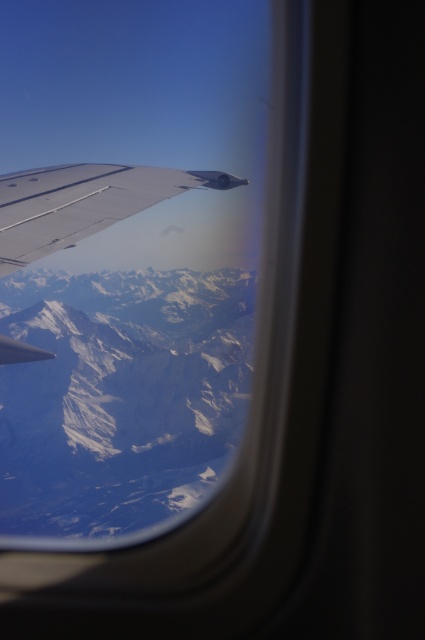
Can you confirm if white snow-covered mountain range at center is positioned to the right of silver metallic wing at upper left?

Incorrect, white snow-covered mountain range at center is not on the right side of silver metallic wing at upper left.

Between white snow-covered mountain range at center and silver metallic wing at upper left, which one has less height?

With less height is silver metallic wing at upper left.

The width and height of the screenshot is (425, 640). I want to click on white snow-covered mountain range at center, so click(x=121, y=396).